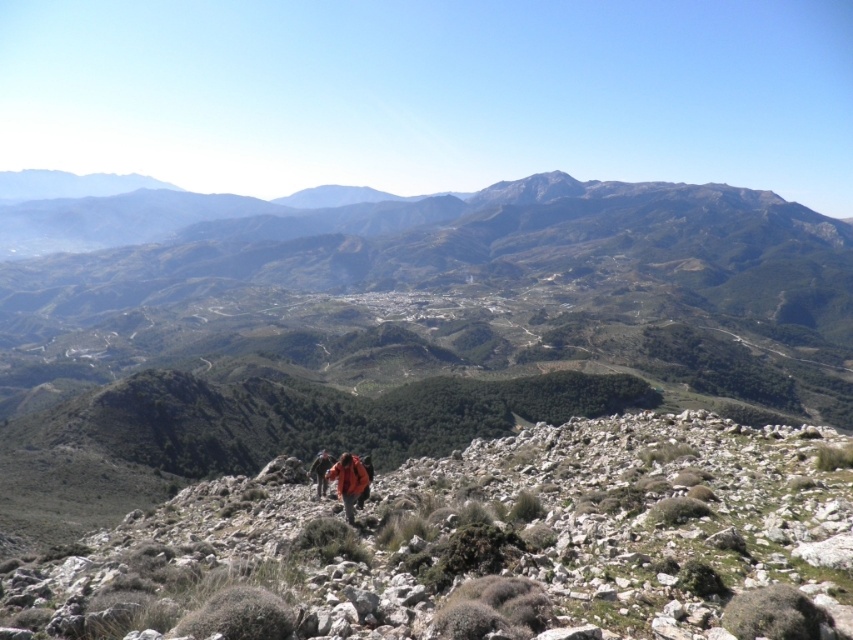
In order to click on orange fabric jacket at center in this screenshot , I will do `click(347, 481)`.

Does orange fabric jacket at center come in front of orange fabric backpack at center?

That is True.

The width and height of the screenshot is (853, 640). Identify the location of orange fabric jacket at center. (347, 481).